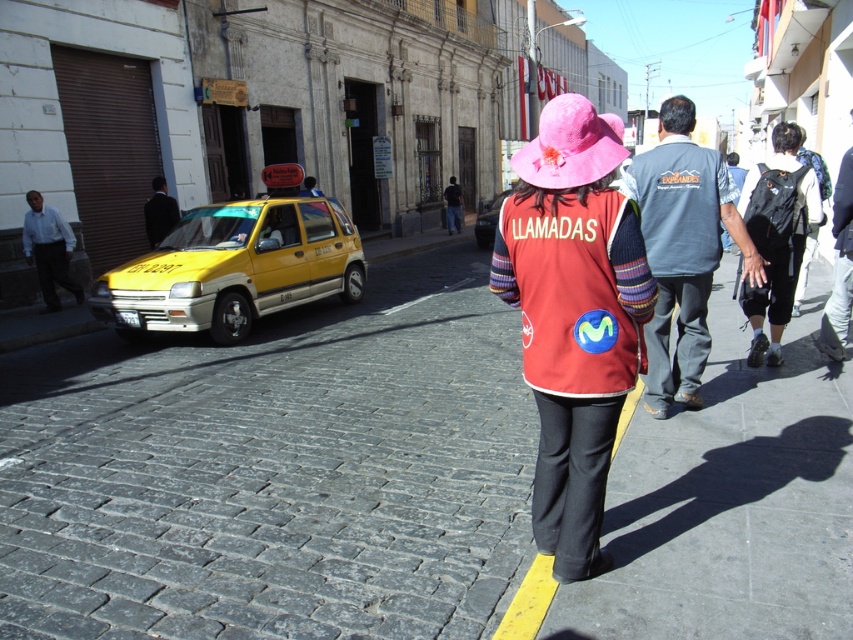
You are standing at the camera position and want to walk to the cobblestone pavement at center. Which direction should you move to reach it?

The cobblestone pavement at center is located at point (276, 472) in the image, so you should move forward and slightly to the right to reach it.

Looking at this image, you are standing at the point marked by the coordinates point [276,472]. Looking around, you see cobblestone pavement at center. What is the closest object to you at this location?

The closest object to you at point [276,472] is the cobblestone pavement at center, as the coordinates directly correspond to it according to the description.

You are a pedestrian standing on the sidewalk next to the yellow matte taxi at left. You need to cross the street to reach the blue denim jeans at right. The crosswalk is 6 meters away from your current position. Can you safely cross the street without needing to walk further?

The distance between the yellow matte taxi at left and the blue denim jeans at right is 5.95 meters, which is just under the 6 meter crosswalk length. Therefore, you can safely cross the street without needing to walk further.